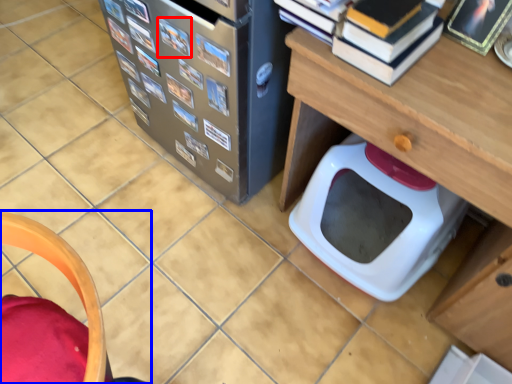
Question: Which point is further to the camera, book (highlighted by a red box) or furniture (highlighted by a blue box)?

Choices:
 (A) book
 (B) furniture

Answer: (A)